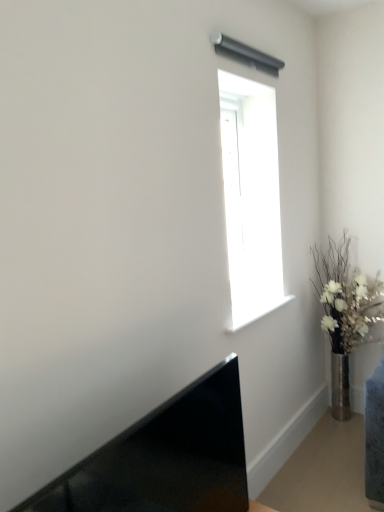
Question: Is silver metallic vase at right at the left side of transparent glass window at upper center?

Choices:
 (A) no
 (B) yes

Answer: (A)

Question: From a real-world perspective, is silver metallic vase at right over transparent glass window at upper center?

Choices:
 (A) yes
 (B) no

Answer: (B)

Question: Can you confirm if silver metallic vase at right is bigger than transparent glass window at upper center?

Choices:
 (A) no
 (B) yes

Answer: (B)

Question: Is silver metallic vase at right positioned before transparent glass window at upper center?

Choices:
 (A) yes
 (B) no

Answer: (B)

Question: From a real-world perspective, is silver metallic vase at right located beneath transparent glass window at upper center?

Choices:
 (A) no
 (B) yes

Answer: (B)

Question: Is transparent glass window at upper center taller or shorter than silver metallic vase at right?

Choices:
 (A) tall
 (B) short

Answer: (B)

Question: Is transparent glass window at upper center inside the boundaries of silver metallic vase at right, or outside?

Choices:
 (A) inside
 (B) outside

Answer: (B)

Question: Is transparent glass window at upper center to the left or to the right of silver metallic vase at right in the image?

Choices:
 (A) left
 (B) right

Answer: (A)

Question: In terms of width, does transparent glass window at upper center look wider or thinner when compared to silver metallic vase at right?

Choices:
 (A) wide
 (B) thin

Answer: (B)

Question: From the image's perspective, is matte black laptop at lower left positioned above or below transparent glass window at upper center?

Choices:
 (A) above
 (B) below

Answer: (B)

Question: Is matte black laptop at lower left in front of or behind transparent glass window at upper center in the image?

Choices:
 (A) front
 (B) behind

Answer: (A)

Question: Considering the positions of matte black laptop at lower left and transparent glass window at upper center in the image, is matte black laptop at lower left taller or shorter than transparent glass window at upper center?

Choices:
 (A) short
 (B) tall

Answer: (A)

Question: Visually, is matte black laptop at lower left positioned to the left or to the right of transparent glass window at upper center?

Choices:
 (A) right
 (B) left

Answer: (B)

Question: From the image's perspective, is silver metallic vase at right above or below transparent glass window at upper center?

Choices:
 (A) below
 (B) above

Answer: (A)

Question: Considering the positions of silver metallic vase at right and transparent glass window at upper center in the image, is silver metallic vase at right taller or shorter than transparent glass window at upper center?

Choices:
 (A) tall
 (B) short

Answer: (A)